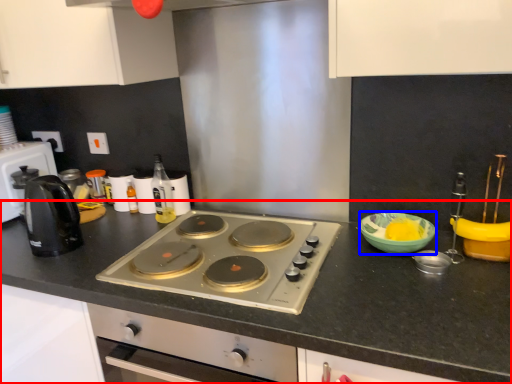
Question: Which point is closer to the camera, countertop (highlighted by a red box) or bowl (highlighted by a blue box)?

Choices:
 (A) countertop
 (B) bowl

Answer: (A)